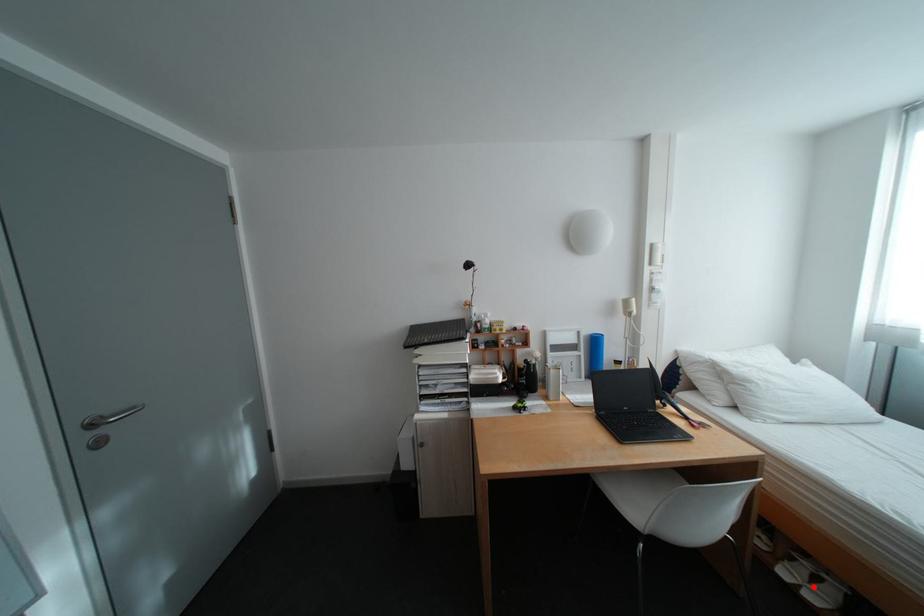
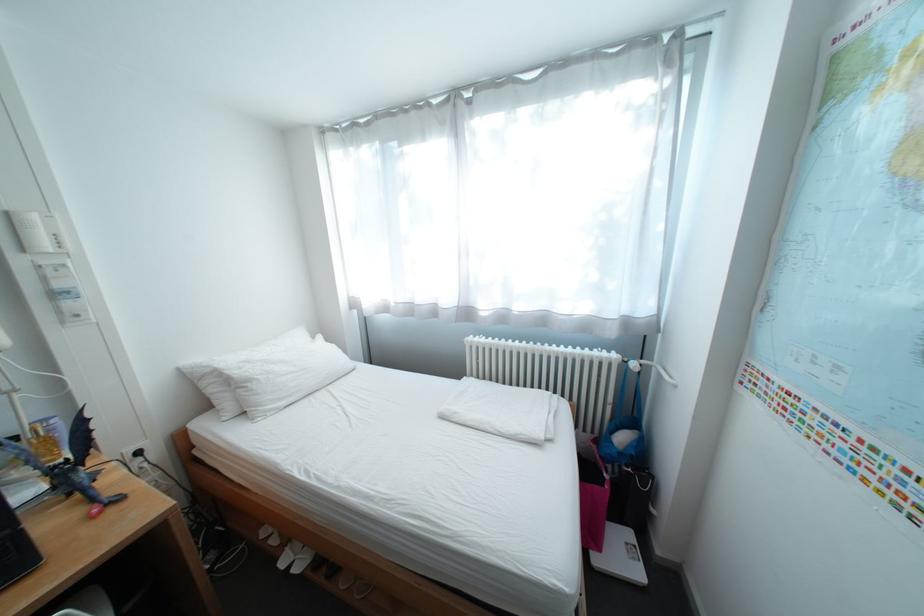
Question: I am providing you with two images of the same scene from different viewpoints. A red point is shown in image1. For the corresponding object point in image2, is it positioned nearer or farther from the camera?

Choices:
 (A) Nearer
 (B) Farther

Answer: (A)